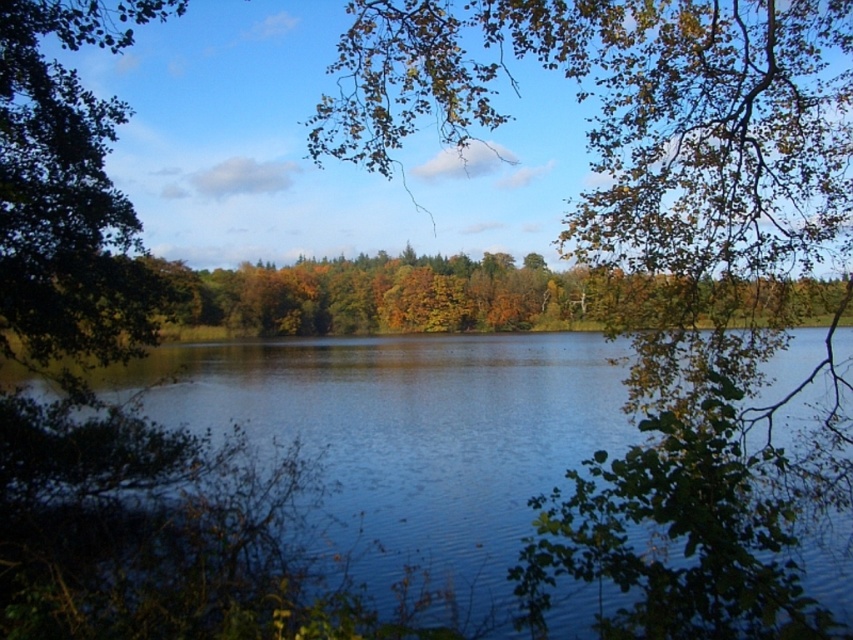
What do you see at coordinates (415, 424) in the screenshot? The height and width of the screenshot is (640, 853). I see `blue liquid water at center` at bounding box center [415, 424].

From the picture: Can you confirm if blue liquid water at center is positioned above green leafy tree at left?

No, blue liquid water at center is not above green leafy tree at left.

You are a GUI agent. You are given a task and a screenshot of the screen. Output one action in this format:
    pyautogui.click(x=<x>, y=<y>)
    Task: Click on the blue liquid water at center
    The width and height of the screenshot is (853, 640).
    Given the screenshot: What is the action you would take?
    pyautogui.click(x=415, y=424)